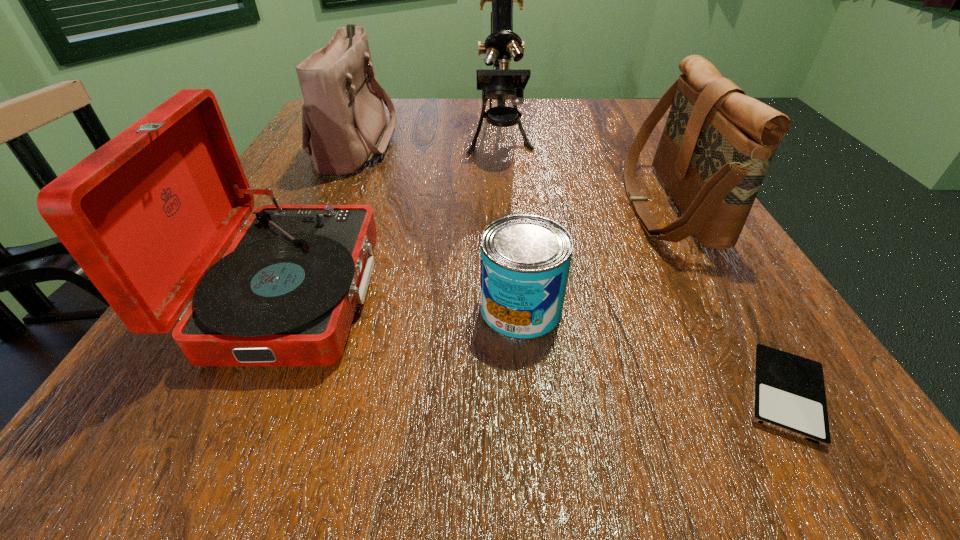
Image resolution: width=960 pixels, height=540 pixels. What are the coordinates of `free location located on the front-facing side of the right shoulder bag` in the screenshot? It's located at (455, 205).

The image size is (960, 540). I want to click on vacant area situated 0.240m on the front pocket of the left shoulder bag, so click(503, 142).

Where is `vacant space situated on the back of the fifth tallest object`? Image resolution: width=960 pixels, height=540 pixels. vacant space situated on the back of the fifth tallest object is located at coordinates (513, 222).

Find the location of a particular element. Image resolution: width=960 pixels, height=540 pixels. vacant space situated 0.390m on the back of the iPod is located at coordinates (662, 186).

What are the coordinates of `microscope at the far edge` in the screenshot? It's located at (501, 83).

Locate an element on the screen. shoulder bag at the far edge is located at coordinates (344, 126).

Locate an element on the screen. object that is at the near edge is located at coordinates (789, 396).

In order to click on phonograph_record located at the left edge in this screenshot , I will do `click(147, 216)`.

At what (x,y) coordinates should I click in order to perform the action: click on shoulder bag that is at the left edge. Please return your answer as a coordinate pair (x, y). Image resolution: width=960 pixels, height=540 pixels. Looking at the image, I should click on point(344,126).

Identify the location of shoulder bag situated at the right edge. This screenshot has height=540, width=960. (716, 146).